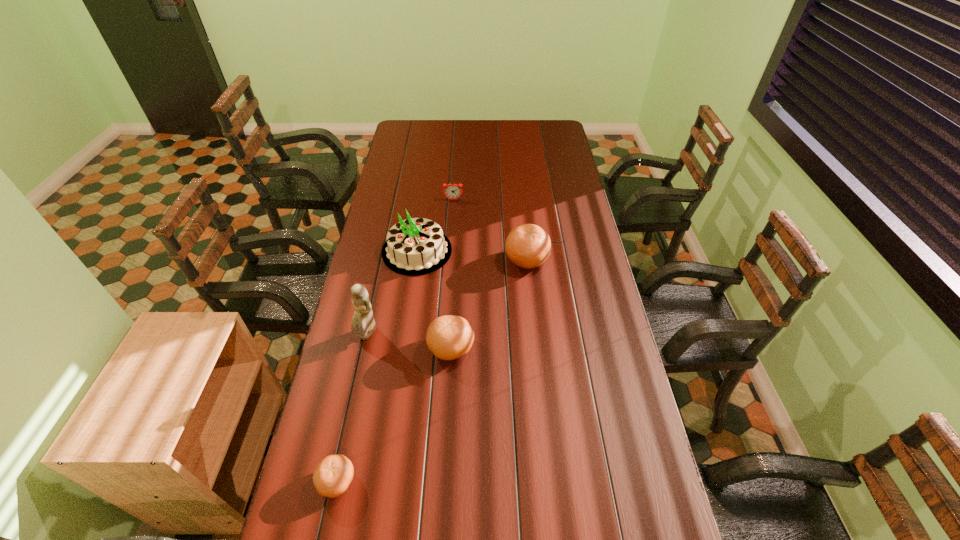
With all clementines evenly spaced, where should an extra clementine be placed on the right to continue the pattern? Please point out a vacant space. Please provide its 2D coordinates. Your answer should be formatted as a tuple, i.e. [(x, y)], where the tuple contains the x and y coordinates of a point satisfying the conditions above.

[(581, 197)]